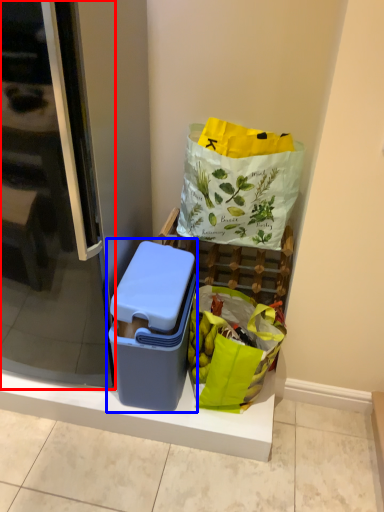
Question: Which object is closer to the camera taking this photo, screen door (highlighted by a red box) or lunch box (highlighted by a blue box)?

Choices:
 (A) screen door
 (B) lunch box

Answer: (A)